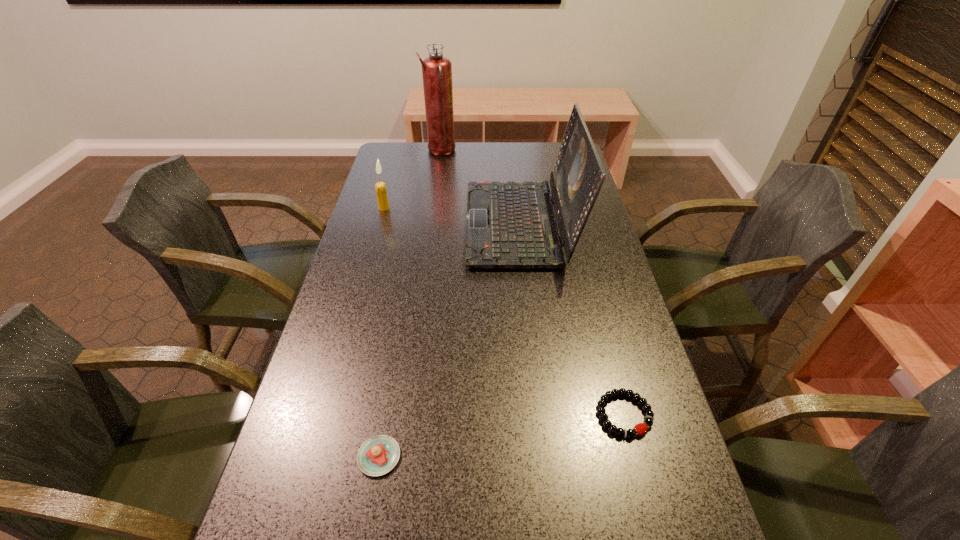
Locate an element on the screen. This screenshot has height=540, width=960. vacant space that satisfies the following two spatial constraints: 1. on the side of the tallest object with the label; 2. on the front side of the pastry is located at coordinates (397, 456).

Identify the location of vacant space that satisfies the following two spatial constraints: 1. on the back side of the pastry; 2. on the left side of the bracelet. The image size is (960, 540). (386, 415).